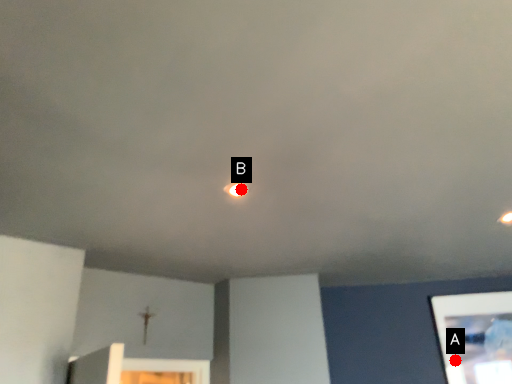
Question: Two points are circled on the image, labeled by A and B beside each circle. Which point is closer to the camera?

Choices:
 (A) A is closer
 (B) B is closer

Answer: (B)